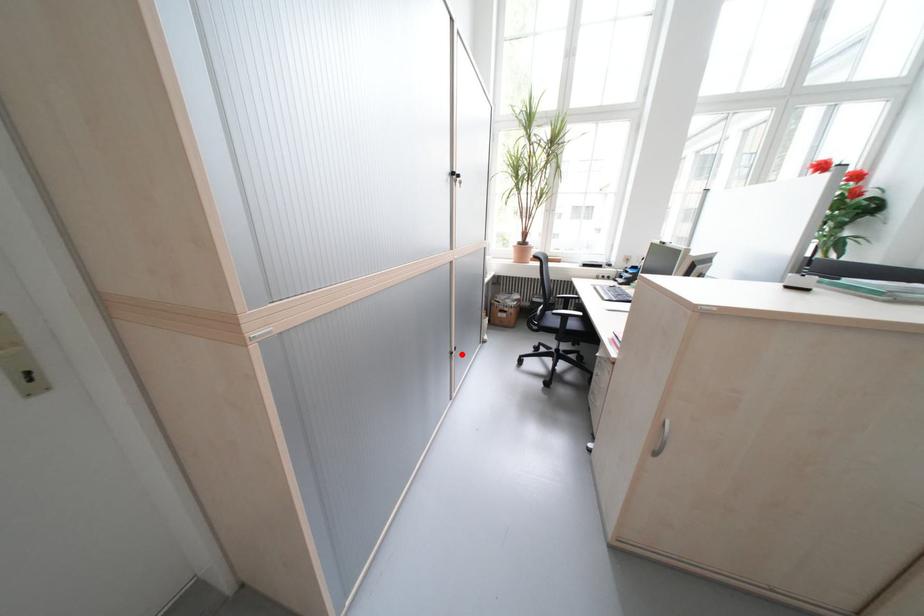
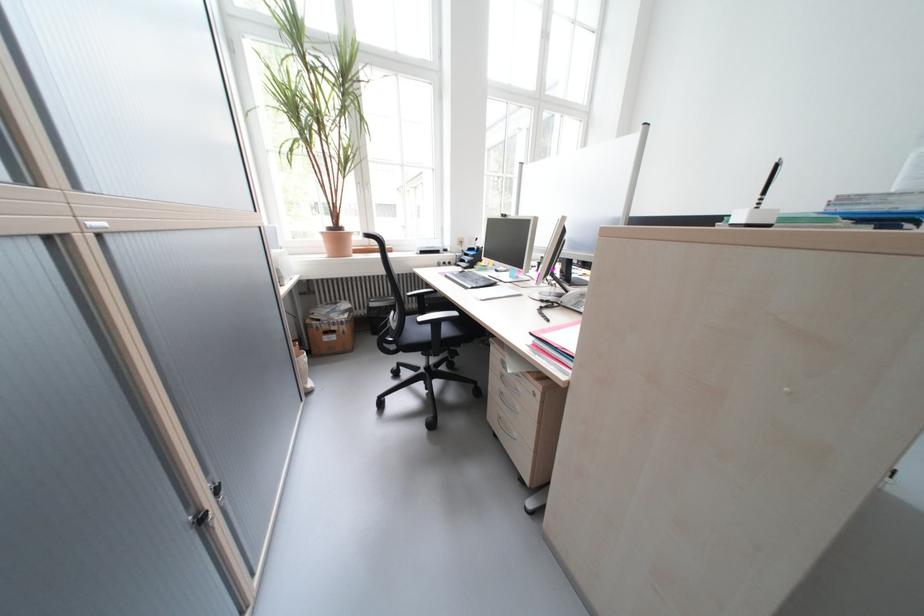
Locate, in the second image, the point that corresponds to the highlighted location in the first image.

(213, 521)